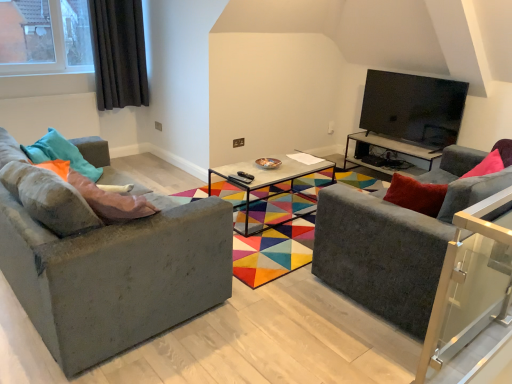
Question: From a real-world perspective, is dark grey fabric curtain at upper left under pink fabric pillow at left, the 2th pillow when ordered from left to right?

Choices:
 (A) yes
 (B) no

Answer: (B)

Question: Does dark grey fabric curtain at upper left have a greater height compared to pink fabric pillow at left, acting as the 1th pillow starting from the right?

Choices:
 (A) no
 (B) yes

Answer: (B)

Question: Is dark grey fabric curtain at upper left looking in the opposite direction of pink fabric pillow at left, the 2th pillow when ordered from left to right?

Choices:
 (A) no
 (B) yes

Answer: (A)

Question: Considering the relative positions of dark grey fabric curtain at upper left and pink fabric pillow at left, the 2th pillow when ordered from left to right, in the image provided, is dark grey fabric curtain at upper left to the left of pink fabric pillow at left, the 2th pillow when ordered from left to right, from the viewer's perspective?

Choices:
 (A) no
 (B) yes

Answer: (B)

Question: Can you confirm if dark grey fabric curtain at upper left is bigger than pink fabric pillow at left, the 2th pillow when ordered from left to right?

Choices:
 (A) yes
 (B) no

Answer: (A)

Question: Can you confirm if dark grey fabric curtain at upper left is thinner than pink fabric pillow at left, acting as the 1th pillow starting from the right?

Choices:
 (A) yes
 (B) no

Answer: (A)

Question: Considering the relative sizes of dark grey fabric curtain at upper left and teal fabric pillow at left, the 1th pillow positioned from the left, in the image provided, is dark grey fabric curtain at upper left smaller than teal fabric pillow at left, the 1th pillow positioned from the left,?

Choices:
 (A) no
 (B) yes

Answer: (A)

Question: Does dark grey fabric curtain at upper left come in front of teal fabric pillow at left, the 1th pillow positioned from the left?

Choices:
 (A) no
 (B) yes

Answer: (A)

Question: Does dark grey fabric curtain at upper left have a lesser width compared to teal fabric pillow at left, which is the second pillow in right-to-left order?

Choices:
 (A) yes
 (B) no

Answer: (A)

Question: Is dark grey fabric curtain at upper left placed right next to teal fabric pillow at left, which is the second pillow in right-to-left order?

Choices:
 (A) no
 (B) yes

Answer: (A)

Question: Is dark grey fabric curtain at upper left at the left side of teal fabric pillow at left, the 1th pillow positioned from the left?

Choices:
 (A) no
 (B) yes

Answer: (B)

Question: Is dark grey fabric curtain at upper left at the right side of teal fabric pillow at left, the 1th pillow positioned from the left?

Choices:
 (A) no
 (B) yes

Answer: (A)

Question: Does pink fabric pillow at left, acting as the 1th pillow starting from the right, have a lesser width compared to textured gray couch at left, which ranks as the second studio couch in right-to-left order?

Choices:
 (A) no
 (B) yes

Answer: (B)